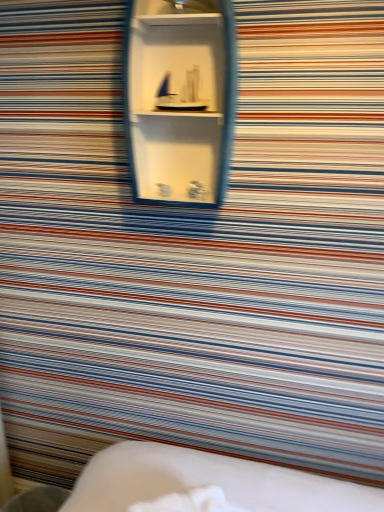
Describe the element at coordinates (180, 99) in the screenshot. The height and width of the screenshot is (512, 384). I see `white glossy shelf at center` at that location.

Find the location of a particular element. white glossy shelf at center is located at coordinates (180, 99).

Measure the distance between white glossy shelf at center and camera.

white glossy shelf at center is 37.80 inches from camera.

Identify the location of white glossy shelf at center. (180, 99).